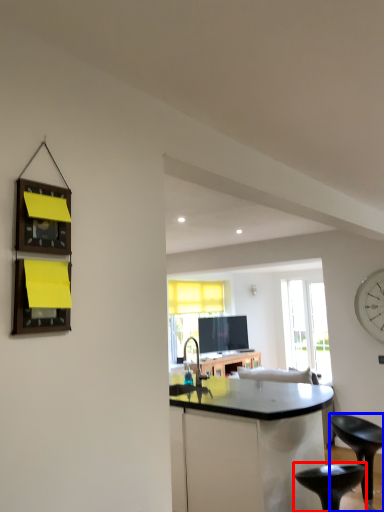
Question: Which object appears farthest to the camera in this image, stool (highlighted by a red box) or stool (highlighted by a blue box)?

Choices:
 (A) stool
 (B) stool

Answer: (B)